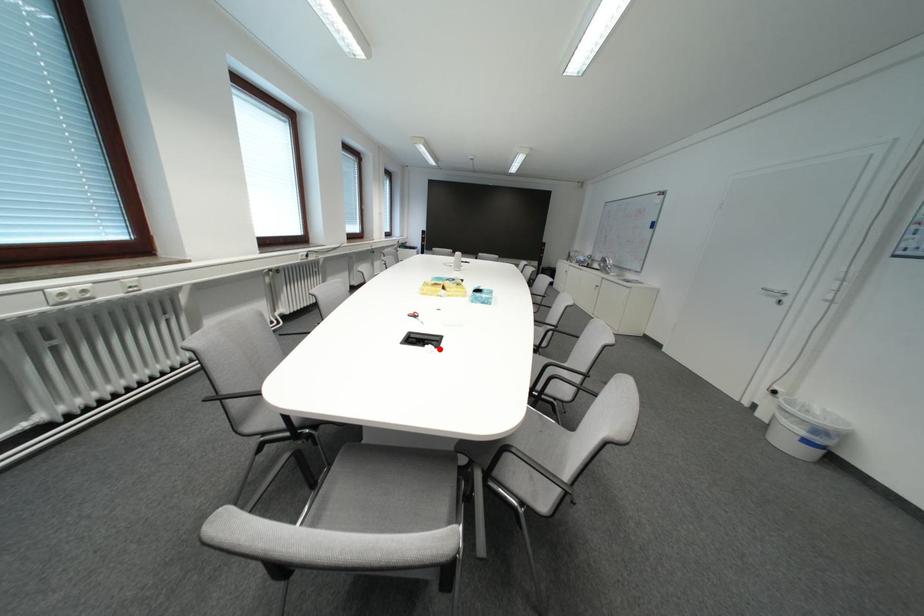
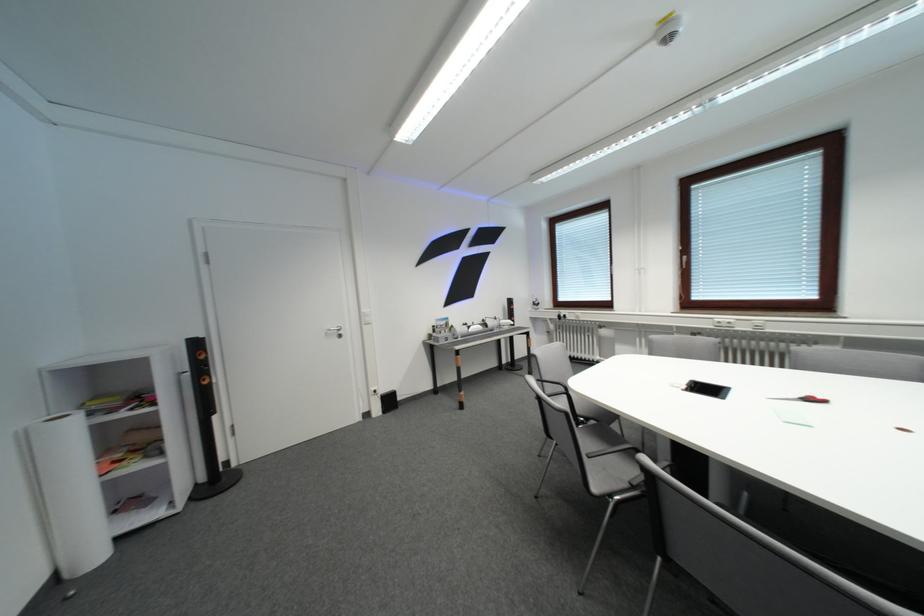
Where in the second image is the point corresponding to the highlighted location from the first image?

(695, 389)